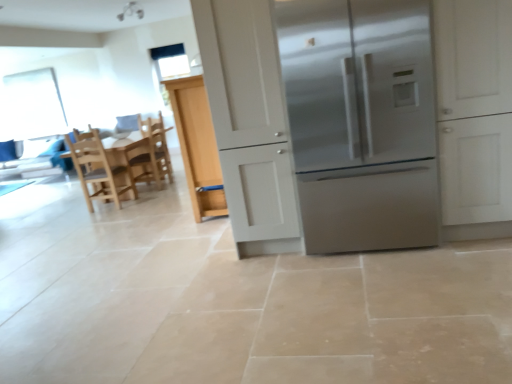
Question: From their relative heights in the image, would you say white matte cabinet at center is taller or shorter than light wood chair at left, the 2th chair positioned from the back?

Choices:
 (A) short
 (B) tall

Answer: (B)

Question: Is point (169, 84) positioned closer to the camera than point (94, 183)?

Choices:
 (A) farther
 (B) closer

Answer: (B)

Question: Based on their relative distances, which object is nearer to the wooden chair at center, which is the first chair from back to front?

Choices:
 (A) white matte cabinet at center
 (B) clear glass window screen at upper center, the 2th window screen positioned from the left
 (C) stainless steel refrigerator at center
 (D) light wood chair at left, the 2th chair positioned from the back
 (E) transparent plastic window screen at upper left, which appears as the 1th window screen when viewed from the left

Answer: (D)

Question: Estimate the real-world distances between objects in this image. Which object is closer to the light wood chair at left, which is the first chair in front-to-back order?

Choices:
 (A) wooden chair at center, which is the second chair in front-to-back order
 (B) clear glass window screen at upper center, the first window screen in the right-to-left sequence
 (C) stainless steel refrigerator at center
 (D) white matte cabinet at center
 (E) transparent plastic window screen at upper left, acting as the second window screen starting from the right

Answer: (A)